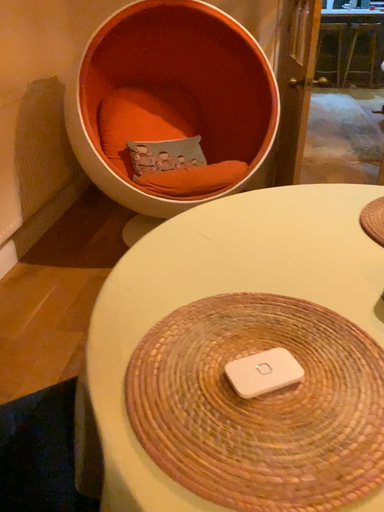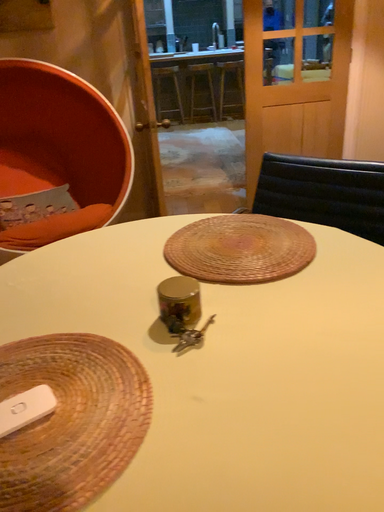
Question: How did the camera likely rotate when shooting the video?

Choices:
 (A) rotated right
 (B) rotated left

Answer: (A)